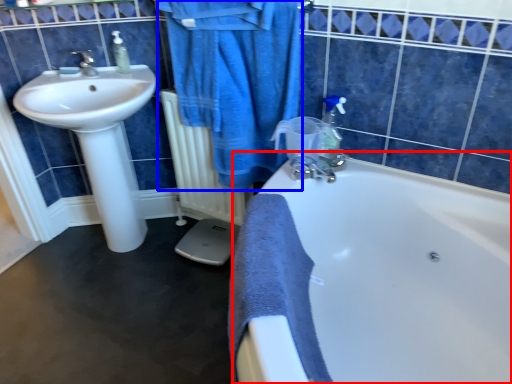
Question: Among these objects, which one is farthest to the camera, bathtub (highlighted by a red box) or bathrobe (highlighted by a blue box)?

Choices:
 (A) bathtub
 (B) bathrobe

Answer: (B)